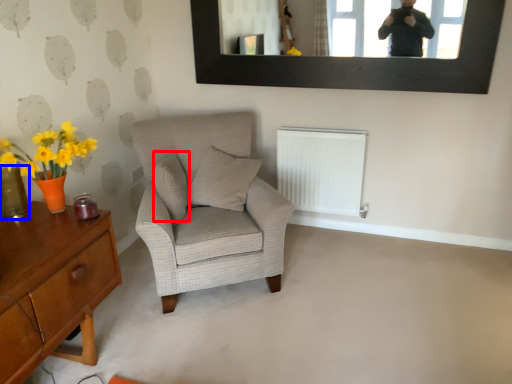
Question: Which object is further to the camera taking this photo, pillow (highlighted by a red box) or glass vase (highlighted by a blue box)?

Choices:
 (A) pillow
 (B) glass vase

Answer: (A)